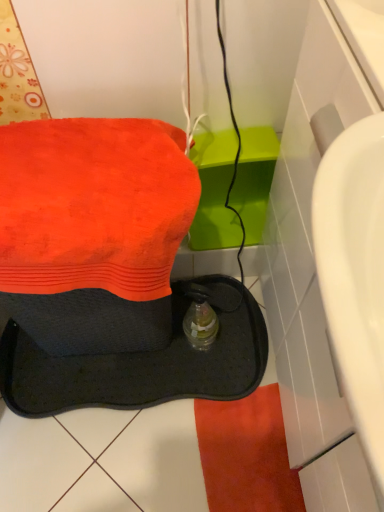
I want to click on free spot to the left of translucent plastic bottle at center, so click(x=152, y=359).